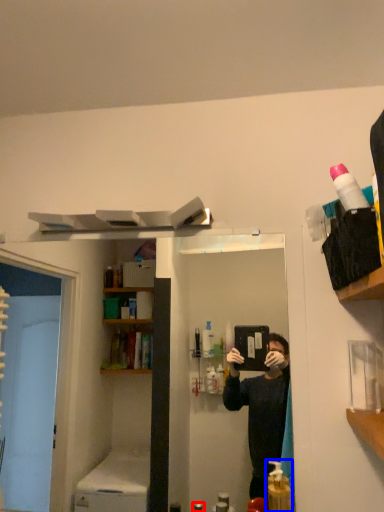
Question: Which object appears farthest to the camera in this image, toiletry (highlighted by a red box) or cleaning product (highlighted by a blue box)?

Choices:
 (A) toiletry
 (B) cleaning product

Answer: (A)